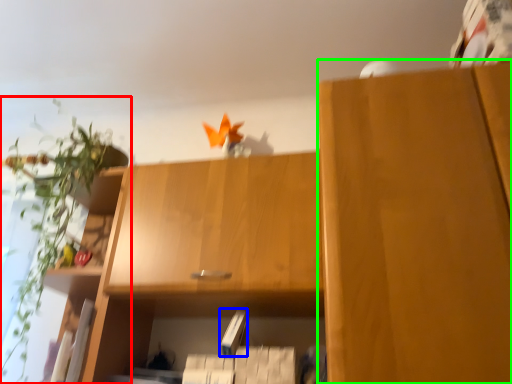
Question: Considering the real-world distances, which object is farthest from houseplant (highlighted by a red box)? paperback book (highlighted by a blue box) or cabinetry (highlighted by a green box)?

Choices:
 (A) paperback book
 (B) cabinetry

Answer: (B)